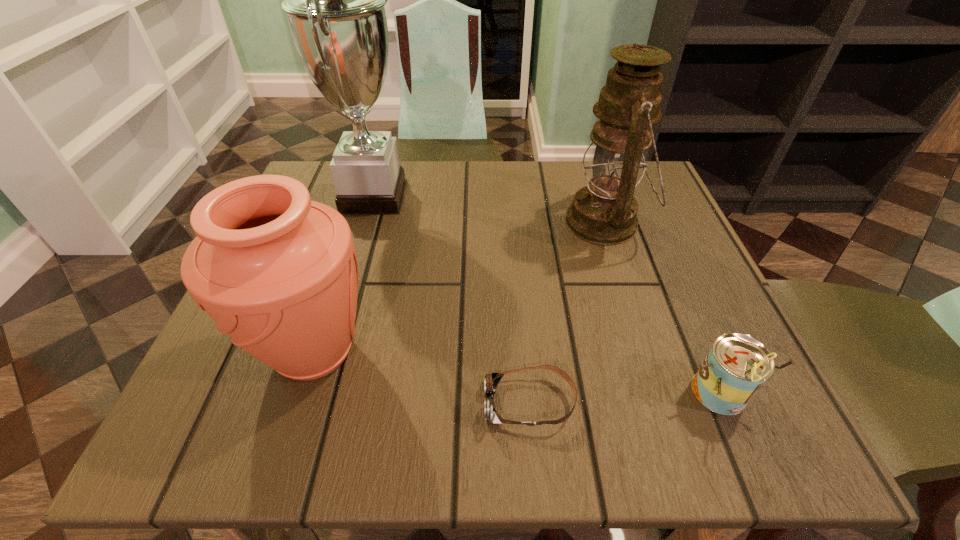
Find the location of a particular element. The image size is (960, 540). oil lamp present at the right edge is located at coordinates (605, 212).

Find the location of a particular element. Image resolution: width=960 pixels, height=540 pixels. can located at the right edge is located at coordinates (736, 367).

Identify the location of object located at the far left corner. (334, 0).

Identify the location of object that is at the near left corner. The height and width of the screenshot is (540, 960). (278, 273).

The image size is (960, 540). What are the coordinates of `object that is at the far right corner` in the screenshot? It's located at (605, 212).

Where is `object at the near right corner`? object at the near right corner is located at coordinates (736, 367).

In the image, there is a desktop. Identify the location of vacant space at the far edge. (576, 174).

Find the location of `free region at the near edge`. free region at the near edge is located at coordinates (652, 426).

Locate an element on the screen. The height and width of the screenshot is (540, 960). blank space at the right edge is located at coordinates (717, 314).

Find the location of a particular element. free space at the far right corner is located at coordinates coord(653,213).